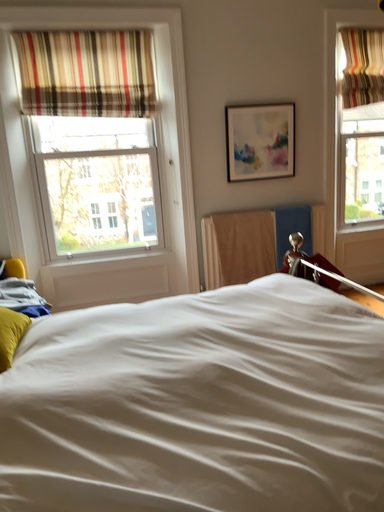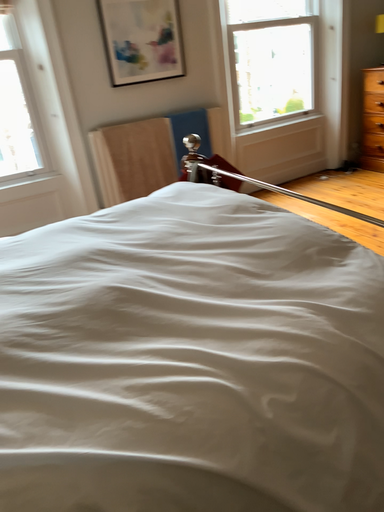
Question: How did the camera likely rotate when shooting the video?

Choices:
 (A) rotated downward
 (B) rotated upward

Answer: (A)